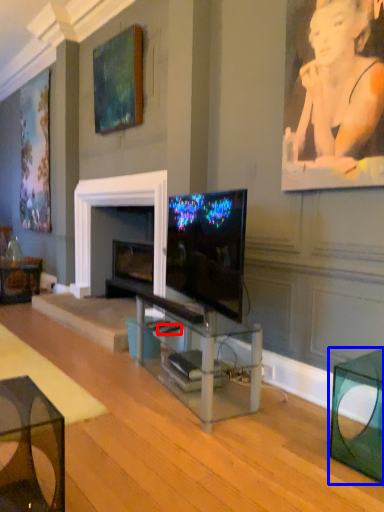
Question: Which of the following is the farthest to the observer, remote control (highlighted by a red box) or table (highlighted by a blue box)?

Choices:
 (A) remote control
 (B) table

Answer: (A)